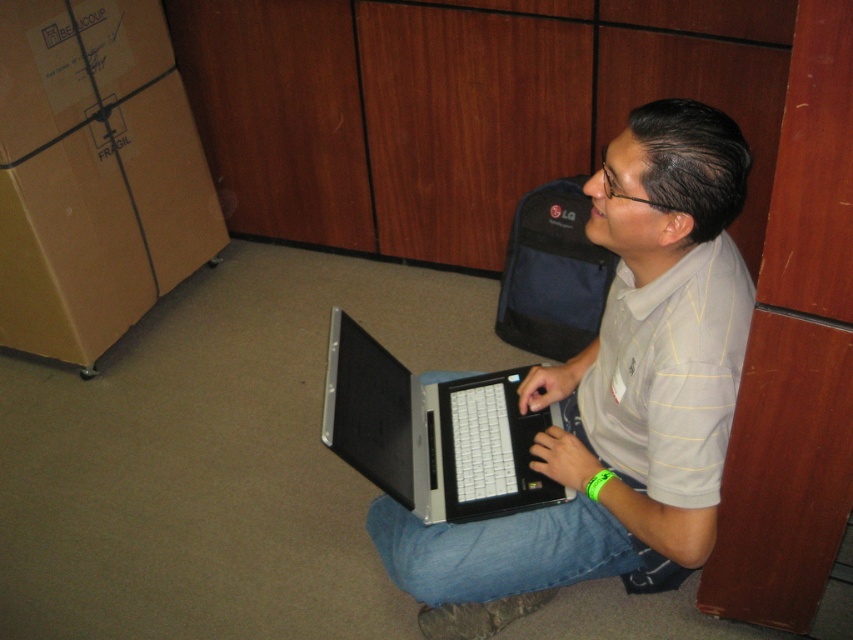
Does gray matte laptop at center have a smaller size compared to silver metallic laptop at center?

No, gray matte laptop at center is not smaller than silver metallic laptop at center.

Is gray matte laptop at center bigger than silver metallic laptop at center?

Indeed, gray matte laptop at center has a larger size compared to silver metallic laptop at center.

Is point (677, 454) closer to camera compared to point (456, 456)?

That is True.

You are a GUI agent. You are given a task and a screenshot of the screen. Output one action in this format:
    pyautogui.click(x=<x>, y=<y>)
    Task: Click on the gray matte laptop at center
    This screenshot has width=853, height=640.
    Given the screenshot: What is the action you would take?
    pyautogui.click(x=616, y=394)